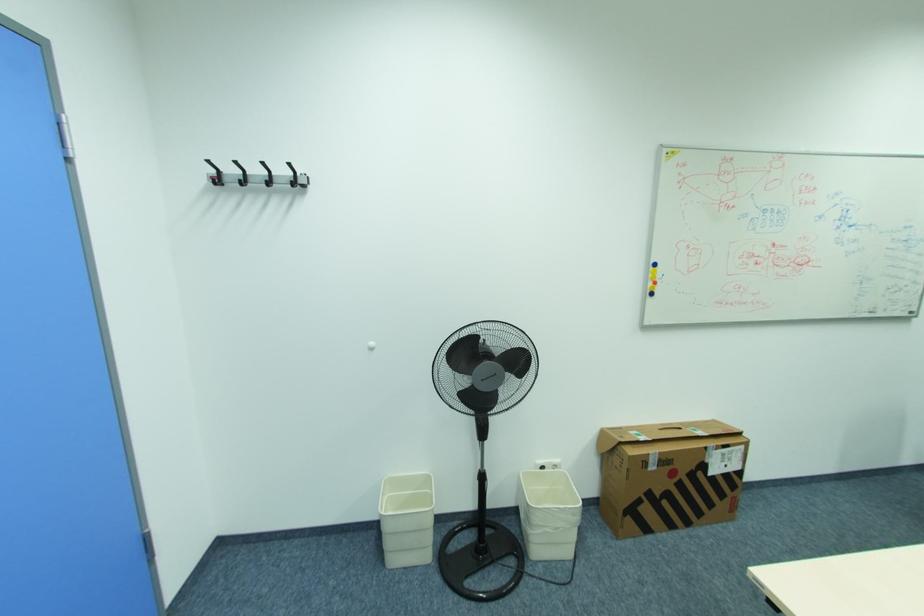
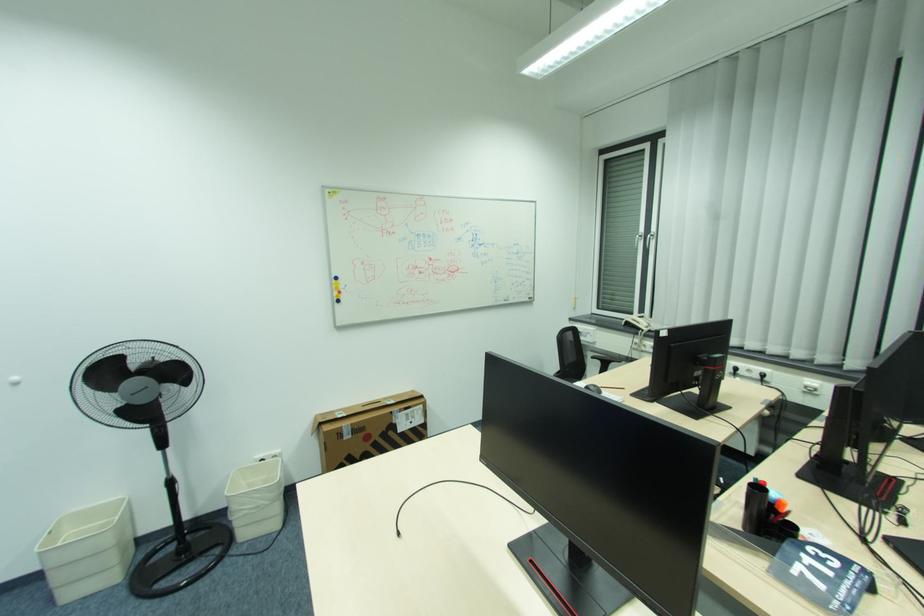
Which direction would the cameraman need to move to produce the second image?

The cameraman moved toward right, backward.